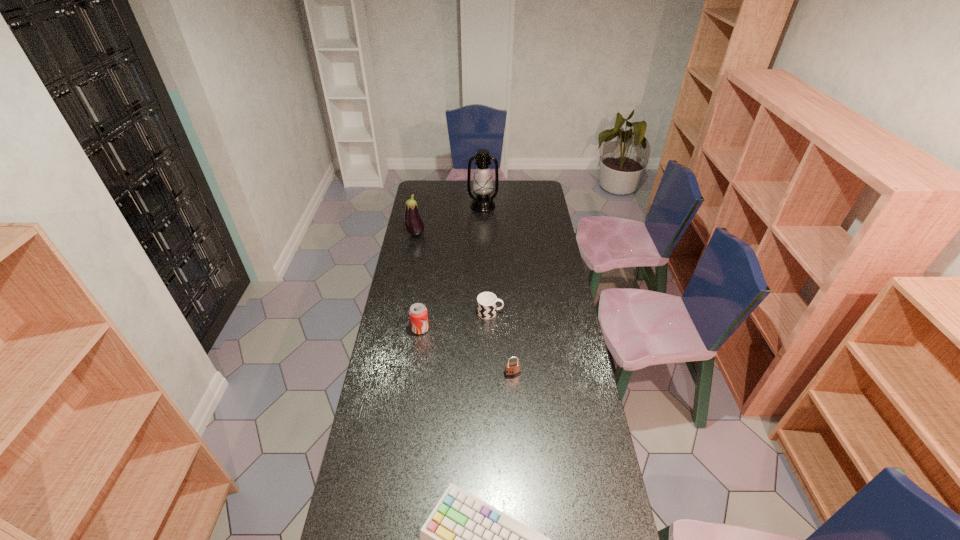
Find the location of a particular element. The image size is (960, 540). vacant space that's between the fourth tallest object and the oil lamp is located at coordinates (497, 290).

Identify the location of vacant area between the soda can and the oil lamp. (451, 267).

Identify the location of free spot between the oil lamp and the fifth shortest object. (449, 220).

The height and width of the screenshot is (540, 960). I want to click on vacant region between the oil lamp and the third farthest object, so click(x=487, y=259).

Locate an element on the screen. The height and width of the screenshot is (540, 960). free space that is in between the fourth shortest object and the farthest object is located at coordinates (451, 267).

Locate an element on the screen. Image resolution: width=960 pixels, height=540 pixels. vacant point located between the fifth shortest object and the second nearest object is located at coordinates (464, 304).

The image size is (960, 540). Find the location of `free space between the soda can and the second nearest object`. free space between the soda can and the second nearest object is located at coordinates (467, 352).

Image resolution: width=960 pixels, height=540 pixels. What are the coordinates of `object that stands as the fifth closest to the eggplant` in the screenshot? It's located at (464, 539).

Find the location of a particular element. Image resolution: width=960 pixels, height=540 pixels. the second closest object to the fifth farthest object is located at coordinates (418, 314).

The image size is (960, 540). Identify the location of free spot that satisfies the following two spatial constraints: 1. on the side of the second shortest object with the handle; 2. on the back side of the fourth tallest object. (492, 374).